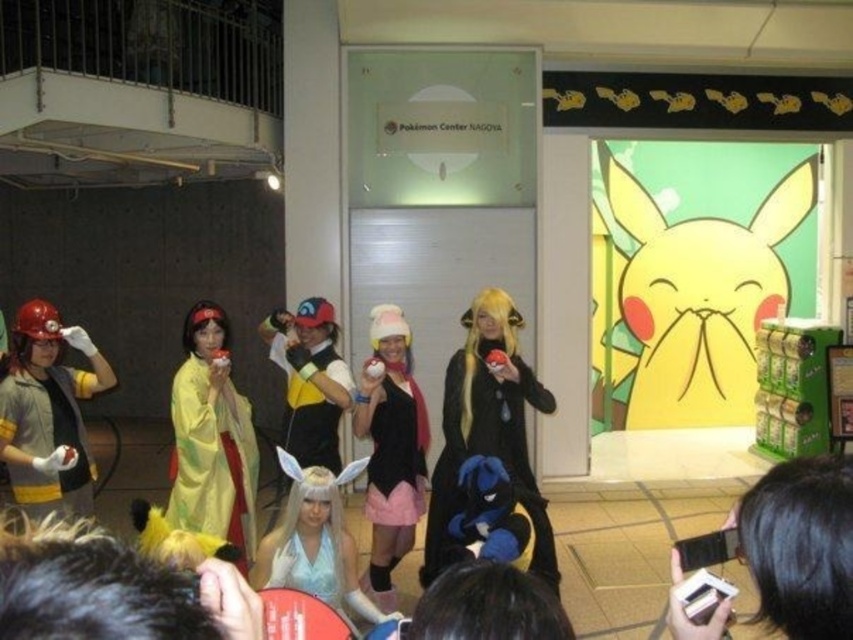
Question: Does matte black scarf at center lie in front of silky blue hair at center?

Choices:
 (A) no
 (B) yes

Answer: (A)

Question: Which point appears closest to the camera in this image?

Choices:
 (A) (280, 563)
 (B) (546, 636)
 (C) (12, 577)

Answer: (C)

Question: Can you confirm if matte yellow vest at left is thinner than silky blue hair at center?

Choices:
 (A) no
 (B) yes

Answer: (A)

Question: Considering the relative positions of matte yellow vest at left and matte black scarf at center in the image provided, where is matte yellow vest at left located with respect to matte black scarf at center?

Choices:
 (A) right
 (B) left

Answer: (B)

Question: Which point appears closest to the camera in this image?

Choices:
 (A) (276, 586)
 (B) (102, 563)

Answer: (B)

Question: Which point appears farthest from the camera in this image?

Choices:
 (A) (372, 550)
 (B) (546, 572)

Answer: (A)